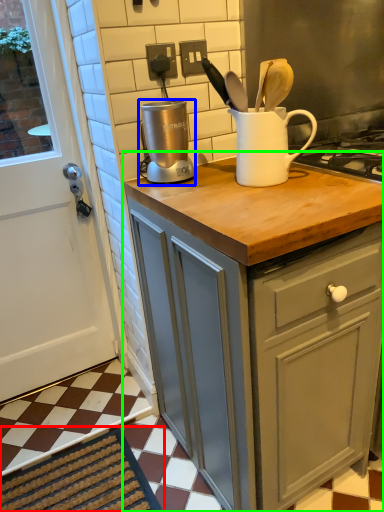
Question: Which object is the closest to the doormat (highlighted by a red box)? Choose among these: kitchen appliance (highlighted by a blue box) or cabinetry (highlighted by a green box).

Choices:
 (A) kitchen appliance
 (B) cabinetry

Answer: (B)